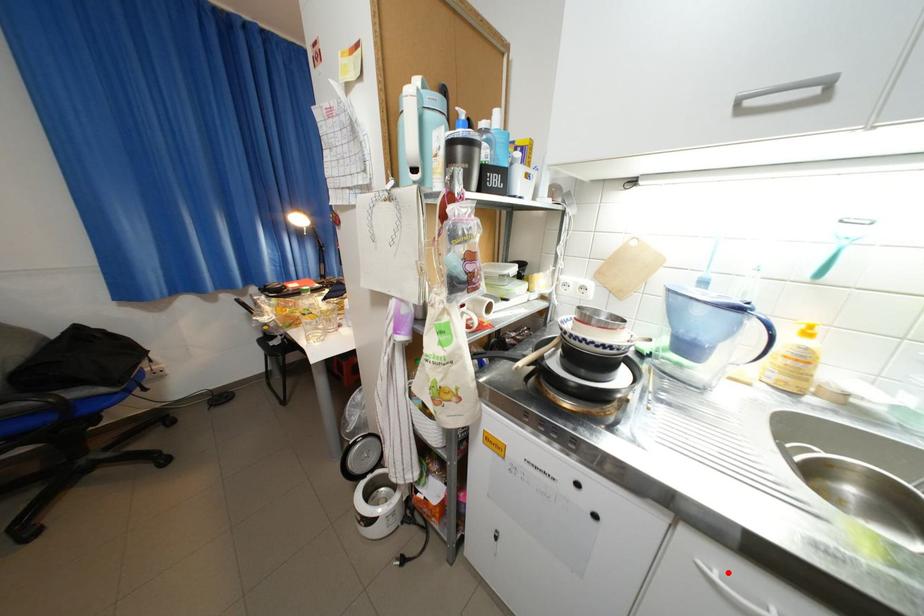
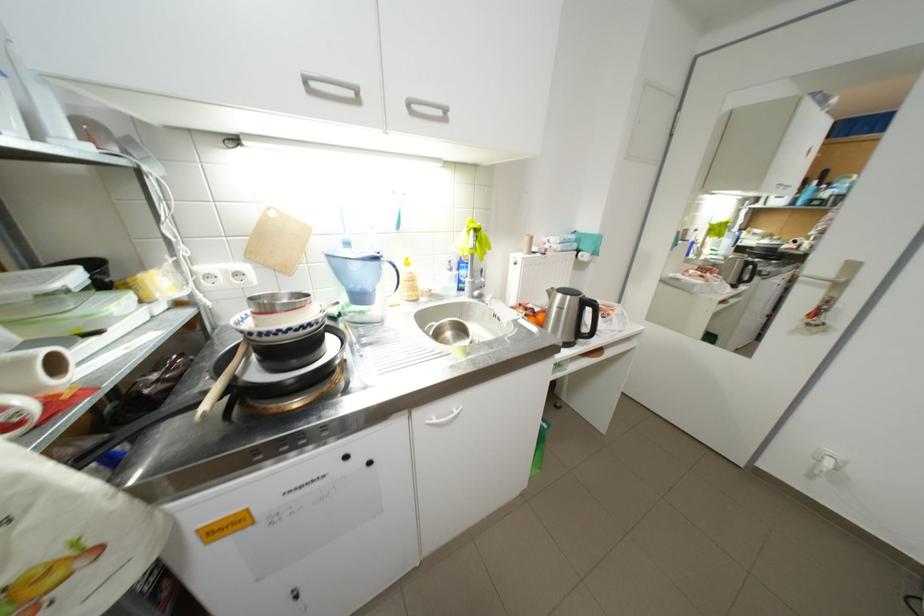
Question: I am providing you with two images of the same scene from different viewpoints. A red point is marked on the first image. Can you still see the location of the red point in image 2?

Choices:
 (A) Yes
 (B) No

Answer: (A)